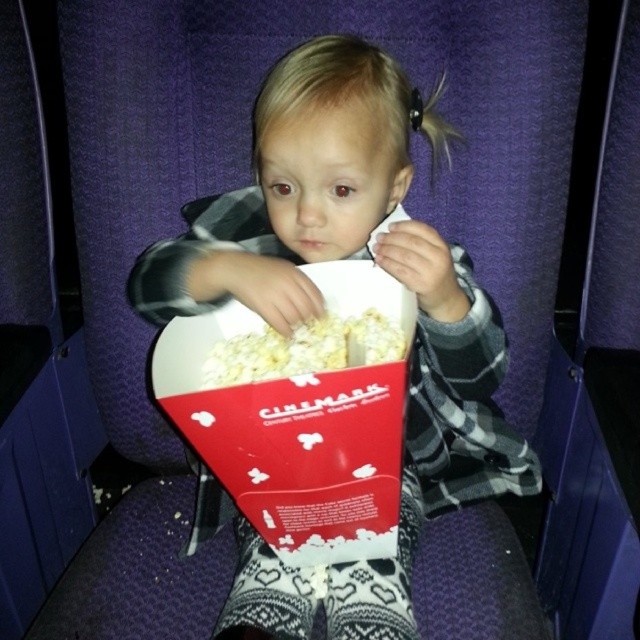
Question: Is white matte popcorn at center bigger than white fluffy popcorn at center?

Choices:
 (A) yes
 (B) no

Answer: (A)

Question: Does white matte popcorn at center lie behind white fluffy popcorn at center?

Choices:
 (A) yes
 (B) no

Answer: (B)

Question: Which point appears closest to the camera in this image?

Choices:
 (A) (282, 241)
 (B) (328, 360)

Answer: (B)

Question: Which point is closer to the camera?

Choices:
 (A) white matte popcorn at center
 (B) white fluffy popcorn at center

Answer: (A)

Question: Which of the following is the closest to the observer?

Choices:
 (A) white matte popcorn at center
 (B) white fluffy popcorn at center

Answer: (A)

Question: Is white matte popcorn at center positioned in front of white fluffy popcorn at center?

Choices:
 (A) yes
 (B) no

Answer: (A)